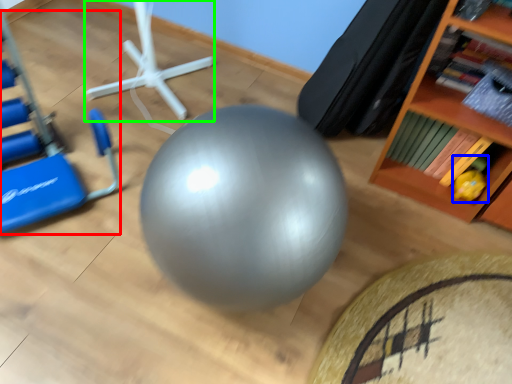
Question: Considering the real-world distances, which object is farthest from swivel chair (highlighted by a red box)? toy (highlighted by a blue box) or sport equipment (highlighted by a green box)?

Choices:
 (A) toy
 (B) sport equipment

Answer: (A)